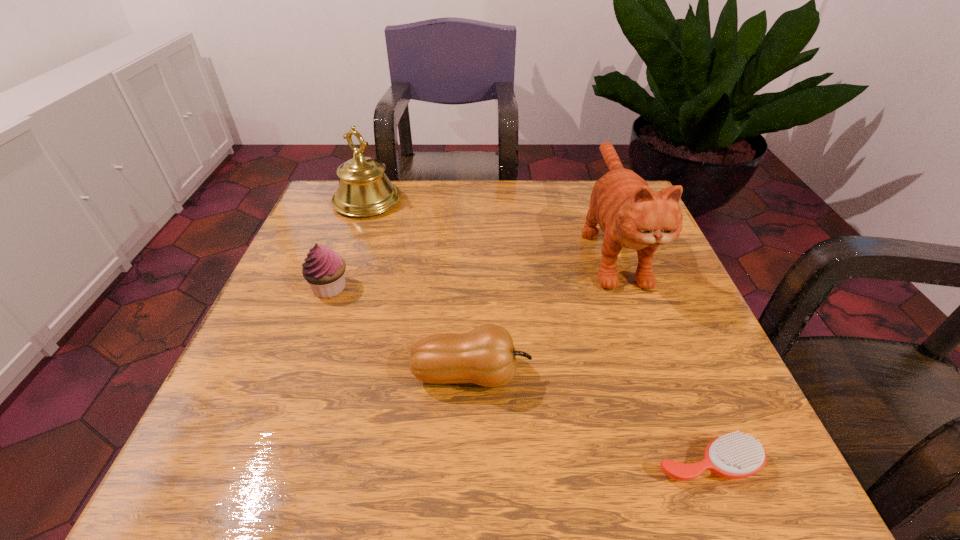
The width and height of the screenshot is (960, 540). I want to click on object at the far right corner, so click(x=631, y=215).

Identify the location of object that is at the near right corner. This screenshot has height=540, width=960. (735, 455).

In the image, there is a desktop. Identify the location of vacant space at the far edge. (505, 206).

The image size is (960, 540). I want to click on vacant space at the near edge, so click(391, 484).

You are a GUI agent. You are given a task and a screenshot of the screen. Output one action in this format:
    pyautogui.click(x=<x>, y=<y>)
    Task: Click on the free space at the left edge of the desktop
    Image resolution: width=960 pixels, height=540 pixels.
    Given the screenshot: What is the action you would take?
    pyautogui.click(x=258, y=322)

Find the location of a particular element. The image size is (960, 540). vacant space at the right edge is located at coordinates (599, 260).

Locate an element on the screen. The width and height of the screenshot is (960, 540). free spot at the far left corner of the desktop is located at coordinates (327, 187).

Identify the location of blank space at the near left corner. This screenshot has height=540, width=960. (246, 478).

Locate an element on the screen. free space at the far right corner is located at coordinates (589, 184).

At what (x,y) coordinates should I click in order to perform the action: click on free space between the fourth shortest object and the cupcake. Please return your answer as a coordinate pair (x, y). This screenshot has width=960, height=540. Looking at the image, I should click on (348, 244).